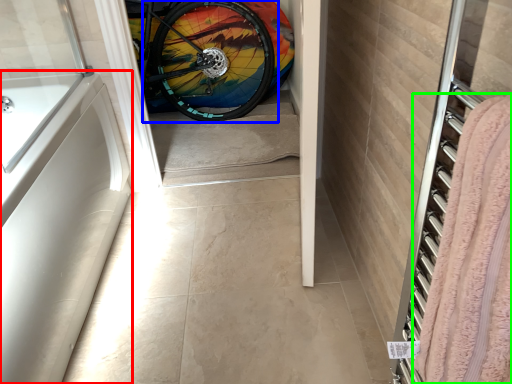
Question: Which object is positioned closest to bath (highlighted by a red box)? Select from bicycle wheel (highlighted by a blue box) and blanket (highlighted by a green box).

Choices:
 (A) bicycle wheel
 (B) blanket

Answer: (B)